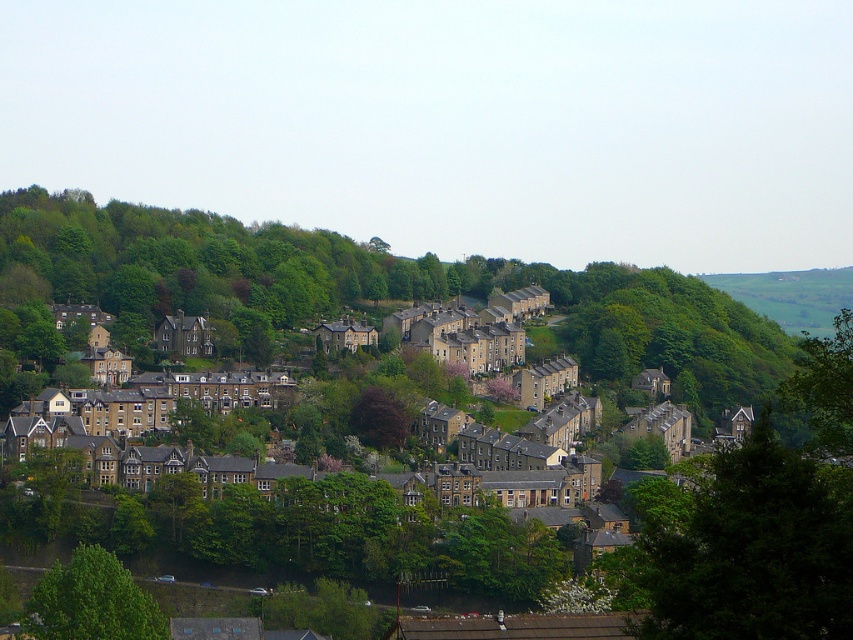
Does point (636, 492) come in front of point (105, 611)?

That is False.

Does point (776, 474) come farther from viewer compared to point (90, 616)?

No, (776, 474) is closer to viewer.

The width and height of the screenshot is (853, 640). Identify the location of green leafy tree at center. (744, 547).

Can you confirm if green leafy tree at center is positioned above dark brown textured tree at center?

Actually, green leafy tree at center is below dark brown textured tree at center.

Describe the element at coordinates (744, 547) in the screenshot. I see `green leafy tree at center` at that location.

Locate an element on the screen. This screenshot has width=853, height=640. green leafy tree at center is located at coordinates (744, 547).

Does point (33, 589) come in front of point (361, 400)?

Yes, it is in front of point (361, 400).

Is point (161, 636) closer to camera compared to point (383, 400)?

Yes, point (161, 636) is closer to viewer.

Identify the location of green leafy tree at lower left. This screenshot has height=640, width=853. (91, 602).